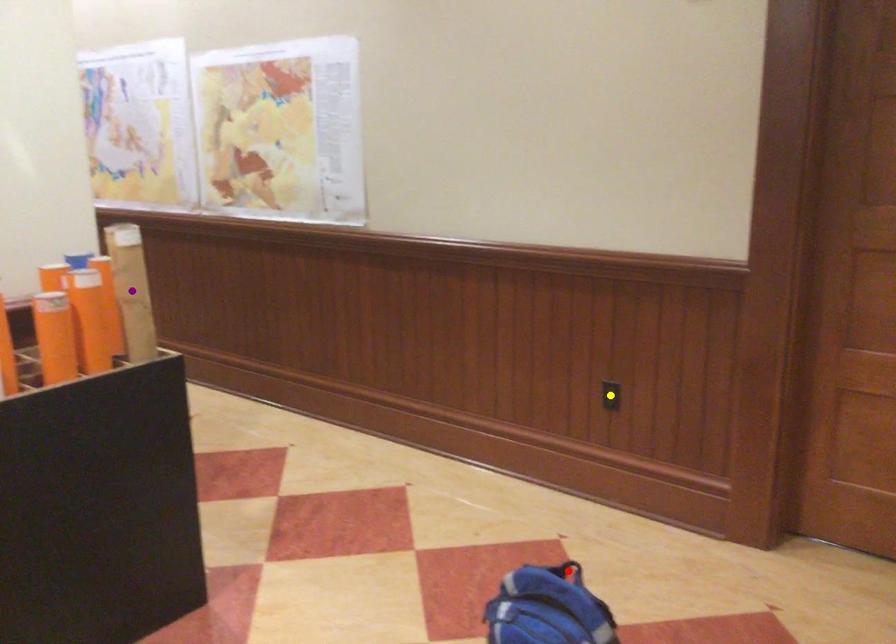
Order these from farthest to nearest:
purple point
red point
yellow point

yellow point
purple point
red point